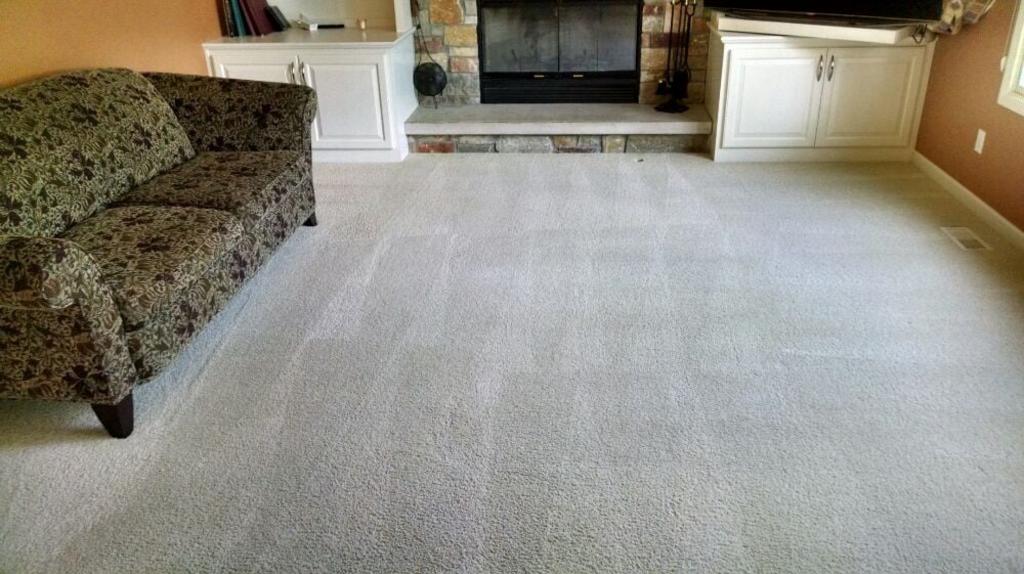
You are a GUI agent. You are given a task and a screenshot of the screen. Output one action in this format:
    pyautogui.click(x=<x>, y=<y>)
    Task: Click on the window
    This screenshot has width=1024, height=574.
    Given the screenshot: What is the action you would take?
    pyautogui.click(x=1021, y=83)